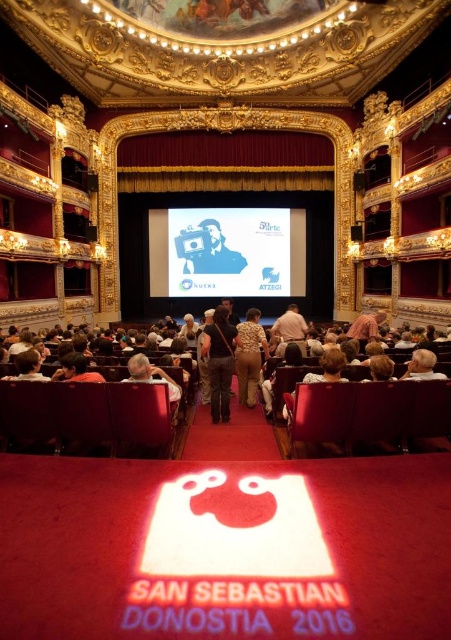
You are an event organizer preparing to seat two guests in the theater. The dark gray fabric jacket at center and the gold sequined dress at center are both visible from the stage. Which guest should you seat closer to the stage to ensure both are equally visible?

You should seat the guest wearing the dark gray fabric jacket at center closer to the stage because it occupies less space than the gold sequined dress at center, so moving it forward would balance their visibility.

You are an attendee at the theater event and want to take a photo of the gold sequined dress at center without the white paper at center blocking the view. Can you adjust your position to do so?

The white paper at center is further to the viewer than gold sequined dress at center, so moving your position slightly forward or backward might allow you to position yourself so the gold sequined dress at center is no longer blocked by the white paper at center.